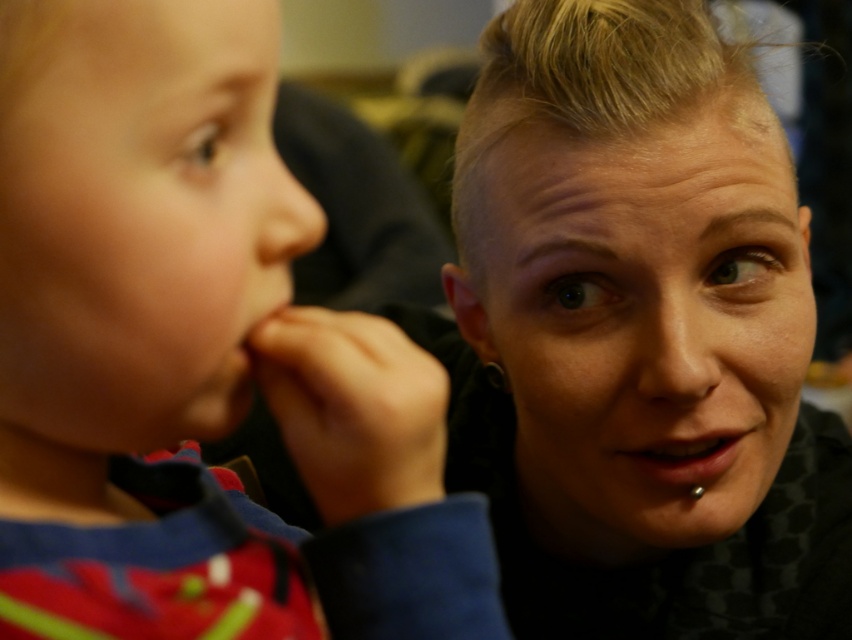
You are holding a 30 cm ruler and want to measure the distance from your eyes to the point marked as point (430, 532) in the image. Will the ruler be long enough to reach that point?

The distance of point (430, 532) from the viewer is 29.52 centimeters. Since the ruler is 30 cm long, it will be long enough to reach the point.

You are a photographer trying to frame a portrait. You notice the matte red shirt at left and the smooth flesh mouth at center in your viewfinder. Which object occupies more horizontal space in the image?

The matte red shirt at left has a greater width than the smooth flesh mouth at center, so it occupies more horizontal space in the image.